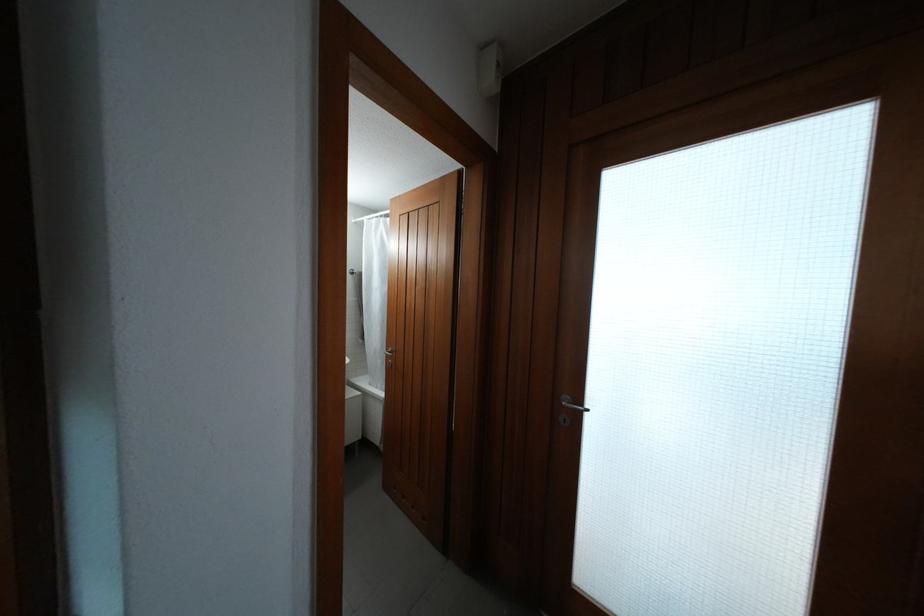
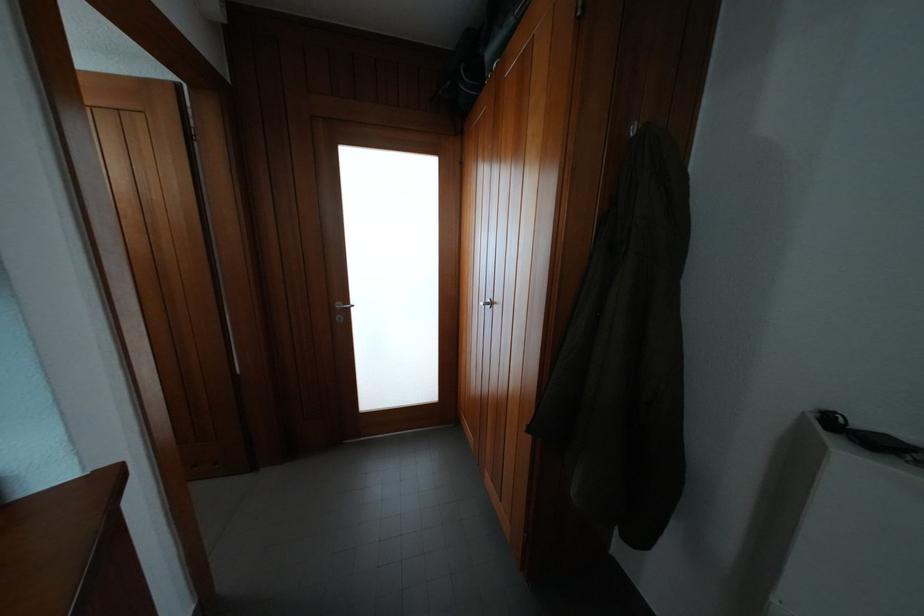
Question: How did the camera likely rotate?

Choices:
 (A) Left
 (B) Right
 (C) Up
 (D) Down

Answer: (B)